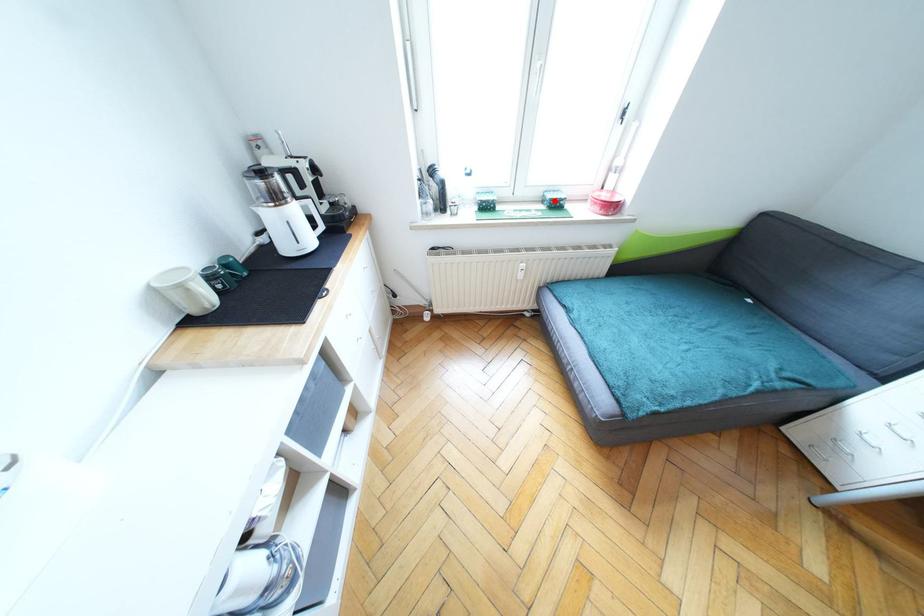
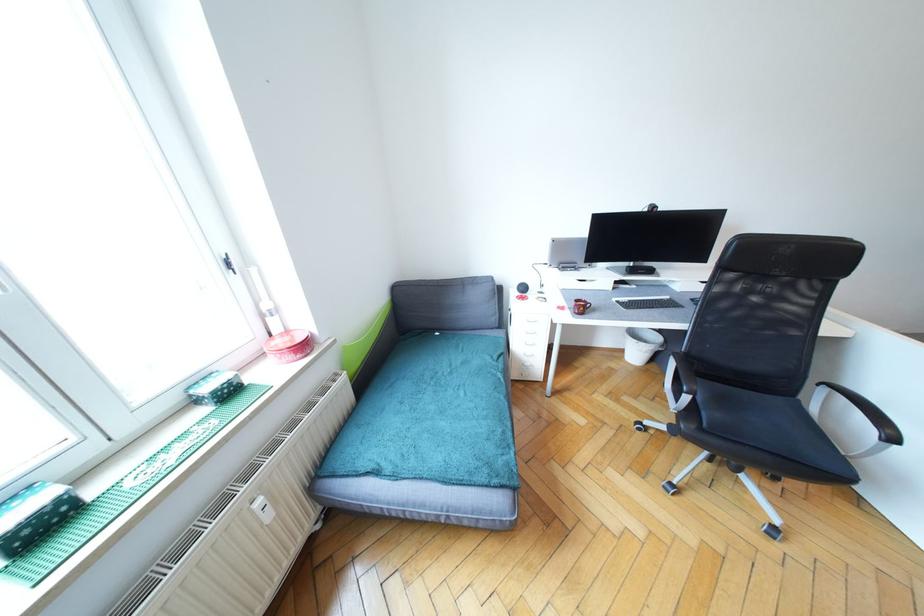
Where in the second image is the point corresponding to the highlighted location from the first image?

(217, 392)